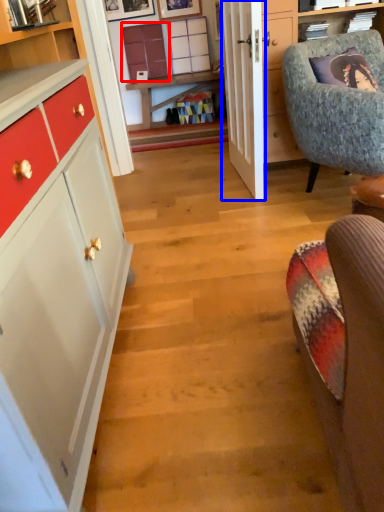
Question: Which object appears farthest to the camera in this image, cabinetry (highlighted by a red box) or door (highlighted by a blue box)?

Choices:
 (A) cabinetry
 (B) door

Answer: (A)